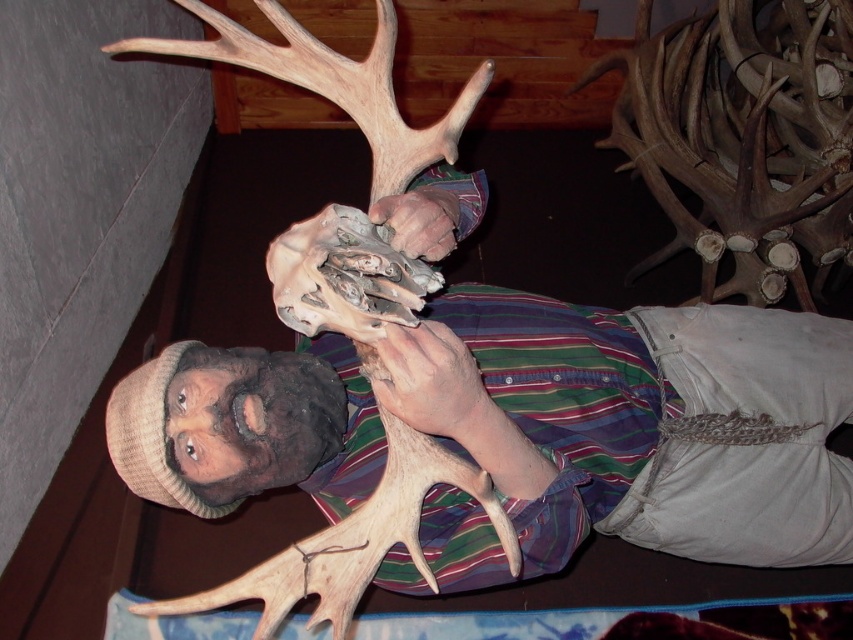
Question: Which of the following is the farthest from the observer?

Choices:
 (A) smooth tan skin at center
 (B) matte brown hand at center

Answer: (B)

Question: Does smooth tan skin at center have a greater width compared to matte brown hand at center?

Choices:
 (A) no
 (B) yes

Answer: (B)

Question: Which point is farther from the camera taking this photo?

Choices:
 (A) (437, 376)
 (B) (410, 228)

Answer: (B)

Question: Is smooth tan skin at center below matte brown hand at center?

Choices:
 (A) no
 (B) yes

Answer: (B)

Question: From the image, what is the correct spatial relationship of smooth tan skin at center in relation to matte brown hand at center?

Choices:
 (A) above
 (B) below

Answer: (B)

Question: Which point is farther to the camera?

Choices:
 (A) matte brown hand at center
 (B) smooth tan skin at center

Answer: (A)